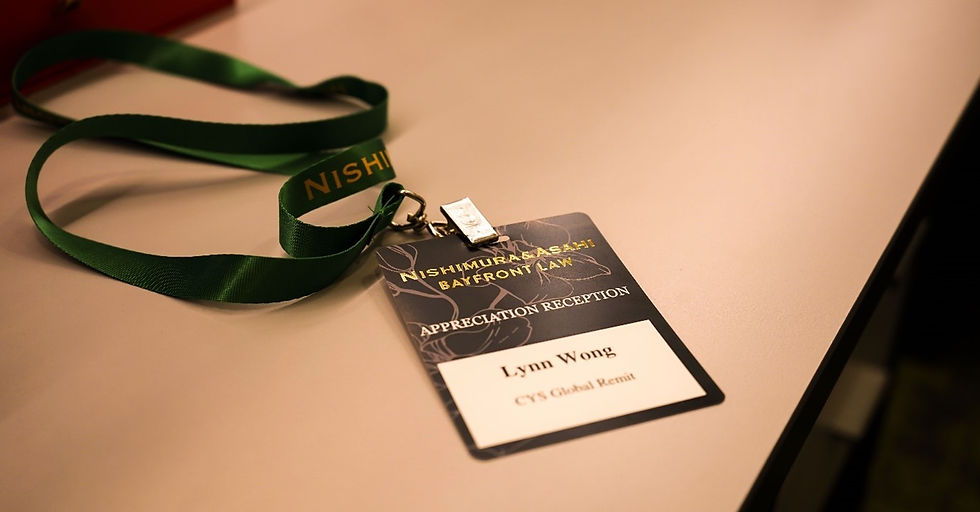
Where is `table`? table is located at coordinates (706, 86), (164, 400).